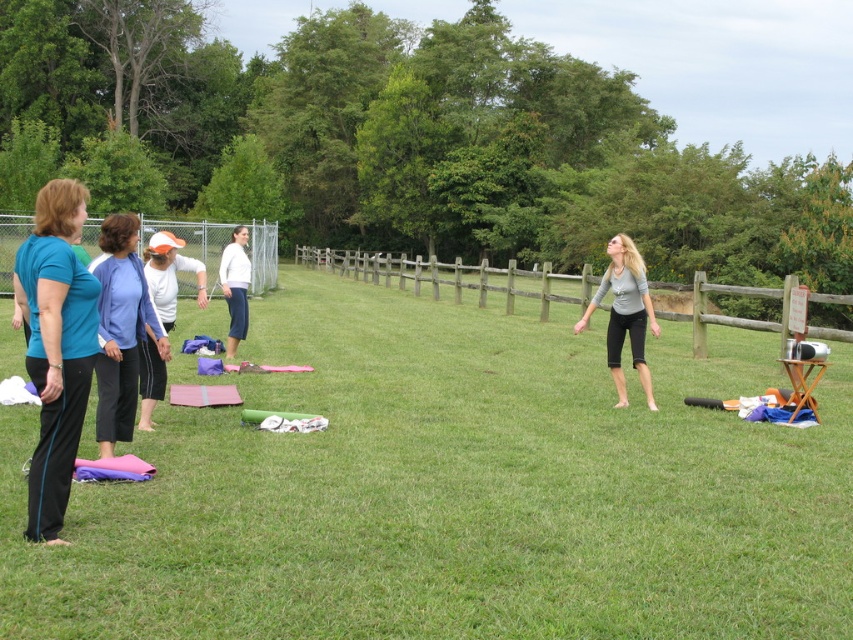
Consider the image. You are standing at the center of the field and want to find the teal matte shirt at left. According to the coordinates provided, in which direction should you look to locate it?

The teal matte shirt at left is located at coordinates point [56,346], which means you should look to the left side of the image to find it.